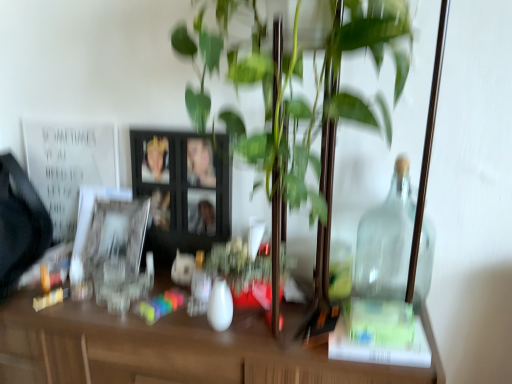
Question: Is green glossy plant at center surrounded by black wooden picture frame at center, the 2th picture frame in the left-to-right sequence?

Choices:
 (A) no
 (B) yes

Answer: (A)

Question: Is black wooden picture frame at center, the 2th picture frame in the left-to-right sequence, in front of green glossy plant at center?

Choices:
 (A) yes
 (B) no

Answer: (B)

Question: From the image's perspective, is black wooden picture frame at center, the 1th picture frame in the right-to-left sequence, located above green glossy plant at center?

Choices:
 (A) yes
 (B) no

Answer: (B)

Question: Is the depth of black wooden picture frame at center, the 2th picture frame in the left-to-right sequence, greater than that of green glossy plant at center?

Choices:
 (A) yes
 (B) no

Answer: (A)

Question: Is the surface of black wooden picture frame at center, the 1th picture frame in the right-to-left sequence, in direct contact with green glossy plant at center?

Choices:
 (A) no
 (B) yes

Answer: (A)

Question: From the image's perspective, is black wooden picture frame at center, the 2th picture frame in the left-to-right sequence, under green glossy plant at center?

Choices:
 (A) yes
 (B) no

Answer: (A)

Question: Can you confirm if green glossy plant at center is smaller than black wooden picture frame at center, the 2th picture frame in the left-to-right sequence?

Choices:
 (A) no
 (B) yes

Answer: (A)

Question: Is green glossy plant at center facing towards black wooden picture frame at center, the 2th picture frame in the left-to-right sequence?

Choices:
 (A) yes
 (B) no

Answer: (B)

Question: Is green glossy plant at center positioned with its back to black wooden picture frame at center, the 2th picture frame in the left-to-right sequence?

Choices:
 (A) no
 (B) yes

Answer: (A)

Question: Is green glossy plant at center further to the viewer compared to black wooden picture frame at center, the 2th picture frame in the left-to-right sequence?

Choices:
 (A) no
 (B) yes

Answer: (A)

Question: Can you confirm if green glossy plant at center is bigger than black wooden picture frame at center, the 2th picture frame in the left-to-right sequence?

Choices:
 (A) yes
 (B) no

Answer: (A)

Question: From a real-world perspective, is green glossy plant at center physically above black wooden picture frame at center, the 2th picture frame in the left-to-right sequence?

Choices:
 (A) yes
 (B) no

Answer: (A)

Question: Is white glossy picture frame at left, acting as the first picture frame starting from the left, behind green glossy plant at center?

Choices:
 (A) yes
 (B) no

Answer: (A)